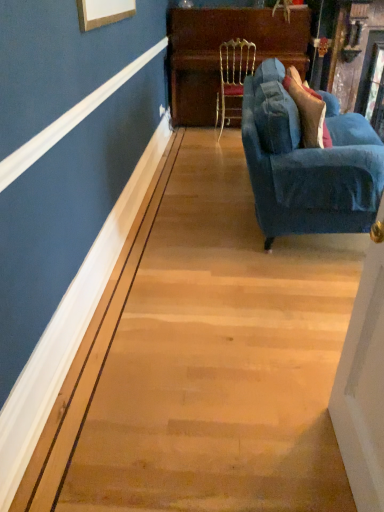
Find the location of a particular element. The width and height of the screenshot is (384, 512). wooden polished dresser at upper center is located at coordinates (219, 54).

Locate an element on the screen. The width and height of the screenshot is (384, 512). wooden polished dresser at upper center is located at coordinates (219, 54).

Can you confirm if velvet blue couch at right is shorter than gold textured chair at center?

Yes, velvet blue couch at right is shorter than gold textured chair at center.

From the picture: Can you confirm if velvet blue couch at right is wider than gold textured chair at center?

Indeed, velvet blue couch at right has a greater width compared to gold textured chair at center.

Which is more to the right, velvet blue couch at right or gold textured chair at center?

velvet blue couch at right.

Based on the photo, which point is more forward, [298,135] or [229,65]?

The point [298,135] is closer.

Is velvet blue couch at right outside of wooden polished dresser at upper center?

Yes, velvet blue couch at right is not within wooden polished dresser at upper center.

Locate an element on the screen. The height and width of the screenshot is (512, 384). dresser above the velvet blue couch at right (from the image's perspective) is located at coordinates (219, 54).

Is velvet blue couch at right smaller than wooden polished dresser at upper center?

No.

From a real-world perspective, which is physically above, gold textured chair at center or wooden polished dresser at upper center?

From a 3D spatial view, wooden polished dresser at upper center is above.

Does gold textured chair at center have a greater height compared to wooden polished dresser at upper center?

No, gold textured chair at center is not taller than wooden polished dresser at upper center.

How different are the orientations of gold textured chair at center and wooden polished dresser at upper center in degrees?

The angle between the facing direction of gold textured chair at center and the facing direction of wooden polished dresser at upper center is 179 degrees.

Does point (208, 21) come behind point (221, 54)?

Yes, it is.

From the image's perspective, does wooden polished dresser at upper center appear lower than gold textured chair at center?

No, from the image's perspective, wooden polished dresser at upper center is not beneath gold textured chair at center.

In terms of width, does wooden polished dresser at upper center look wider or thinner when compared to gold textured chair at center?

In the image, wooden polished dresser at upper center appears to be wider than gold textured chair at center.

In the scene shown: What's the angular difference between gold textured chair at center and velvet blue couch at right's facing directions?

The facing directions of gold textured chair at center and velvet blue couch at right are 88.4 degrees apart.

From the image's perspective, does gold textured chair at center appear lower than velvet blue couch at right?

No, from the image's perspective, gold textured chair at center is not beneath velvet blue couch at right.

Is gold textured chair at center next to velvet blue couch at right?

No, gold textured chair at center is not making contact with velvet blue couch at right.

Can you confirm if gold textured chair at center is shorter than velvet blue couch at right?

In fact, gold textured chair at center may be taller than velvet blue couch at right.

Based on their positions, is wooden polished dresser at upper center located to the left or right of velvet blue couch at right?

In the image, wooden polished dresser at upper center appears on the left side of velvet blue couch at right.

What's the angular difference between wooden polished dresser at upper center and velvet blue couch at right's facing directions?

wooden polished dresser at upper center and velvet blue couch at right are facing 90.2 degrees away from each other.

Does wooden polished dresser at upper center have a greater height compared to velvet blue couch at right?

Yes, wooden polished dresser at upper center is taller than velvet blue couch at right.

This screenshot has width=384, height=512. I want to click on studio couch below the gold textured chair at center (from the image's perspective), so click(307, 164).

Identify the location of studio couch below the wooden polished dresser at upper center (from a real-world perspective). This screenshot has height=512, width=384. (307, 164).

Considering their positions, is wooden polished dresser at upper center positioned closer to gold textured chair at center than velvet blue couch at right?

wooden polished dresser at upper center.

Estimate the real-world distances between objects in this image. Which object is closer to wooden polished dresser at upper center, gold textured chair at center or velvet blue couch at right?

gold textured chair at center is closer to wooden polished dresser at upper center.

Which object lies further to the anchor point wooden polished dresser at upper center, velvet blue couch at right or gold textured chair at center?

velvet blue couch at right is further to wooden polished dresser at upper center.

Considering their positions, is gold textured chair at center positioned further to velvet blue couch at right than wooden polished dresser at upper center?

wooden polished dresser at upper center is further to velvet blue couch at right.

Which object lies further to the anchor point gold textured chair at center, velvet blue couch at right or wooden polished dresser at upper center?

Based on the image, velvet blue couch at right appears to be further to gold textured chair at center.

Considering their positions, is wooden polished dresser at upper center positioned closer to velvet blue couch at right than gold textured chair at center?

gold textured chair at center.

Locate an element on the screen. This screenshot has width=384, height=512. chair between velvet blue couch at right and wooden polished dresser at upper center along the z-axis is located at coordinates (233, 78).